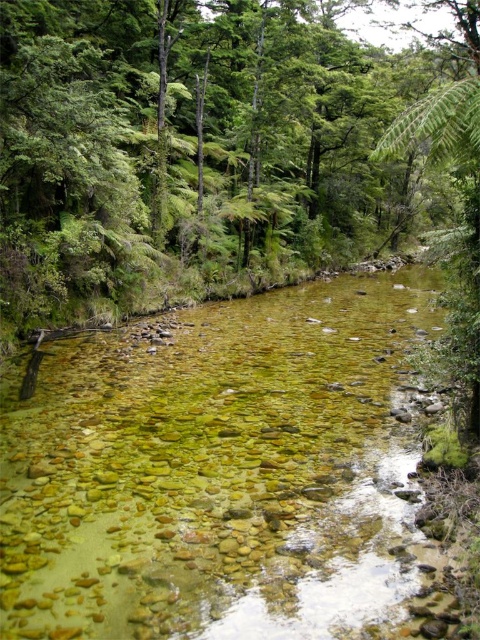
Question: Does translucent rock bed at center appear under green leafy tree at center?

Choices:
 (A) yes
 (B) no

Answer: (A)

Question: Is translucent rock bed at center positioned in front of green leafy tree at center?

Choices:
 (A) no
 (B) yes

Answer: (B)

Question: Which of the following is the farthest from the observer?

Choices:
 (A) green leafy tree at center
 (B) translucent rock bed at center

Answer: (A)

Question: Does translucent rock bed at center have a larger size compared to green leafy tree at center?

Choices:
 (A) no
 (B) yes

Answer: (A)

Question: Which object appears farthest from the camera in this image?

Choices:
 (A) translucent rock bed at center
 (B) green leafy tree at center

Answer: (B)